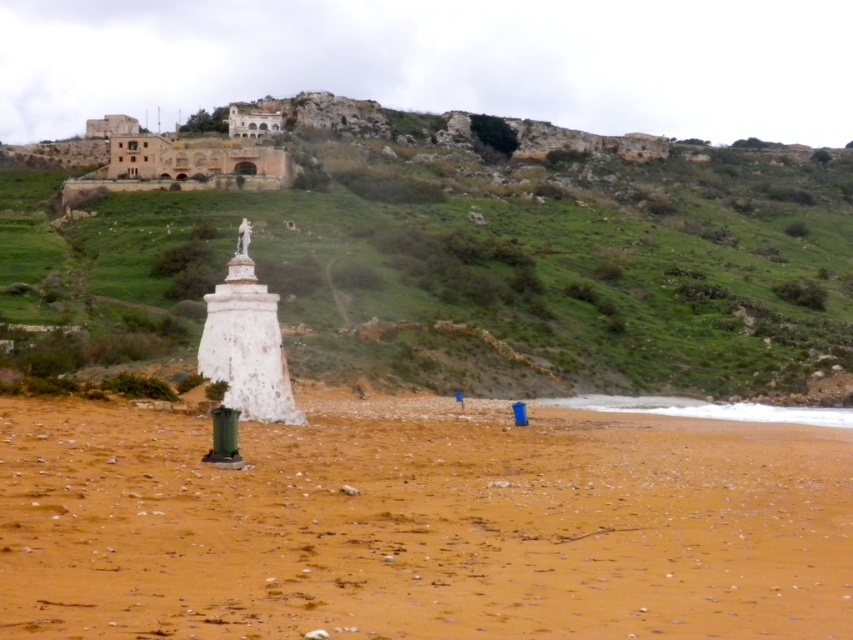
You are standing on the brown sandy beach at lower center and want to climb up to the green grassy hillside at upper center. Is the hillside in front of or behind you?

The green grassy hillside at upper center is in front of you because the brown sandy beach at lower center is behind it.